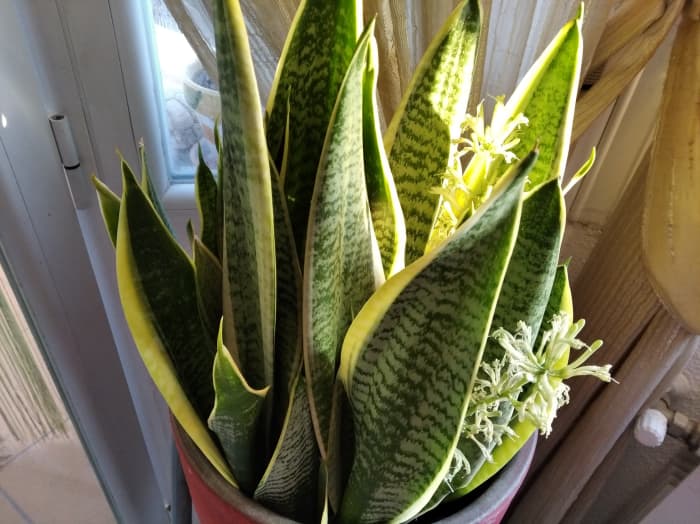
You are a GUI agent. You are given a task and a screenshot of the screen. Output one action in this format:
    pyautogui.click(x=<x>, y=<y>)
    Task: Click on the door hinge
    
    Given the screenshot: What is the action you would take?
    pyautogui.click(x=64, y=135), pyautogui.click(x=77, y=185)